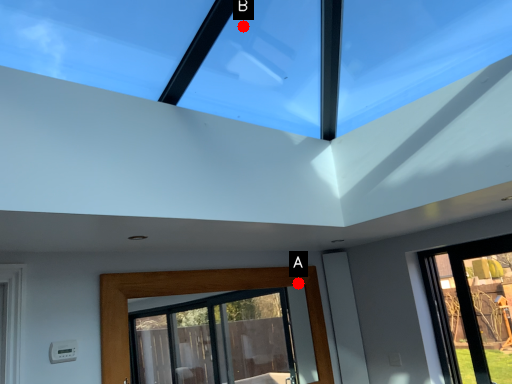
Question: Two points are circled on the image, labeled by A and B beside each circle. Which point is farther to the camera?

Choices:
 (A) A is further
 (B) B is further

Answer: (A)